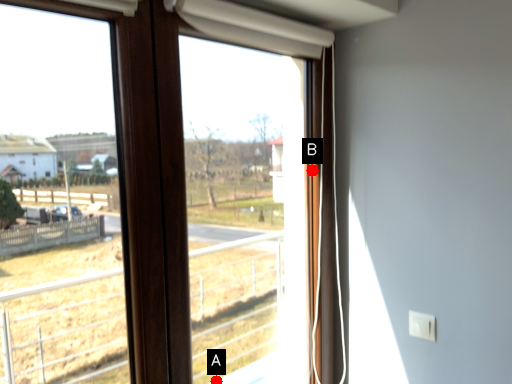
Question: Two points are circled on the image, labeled by A and B beside each circle. Which point is further to the camera?

Choices:
 (A) A is further
 (B) B is further

Answer: (A)